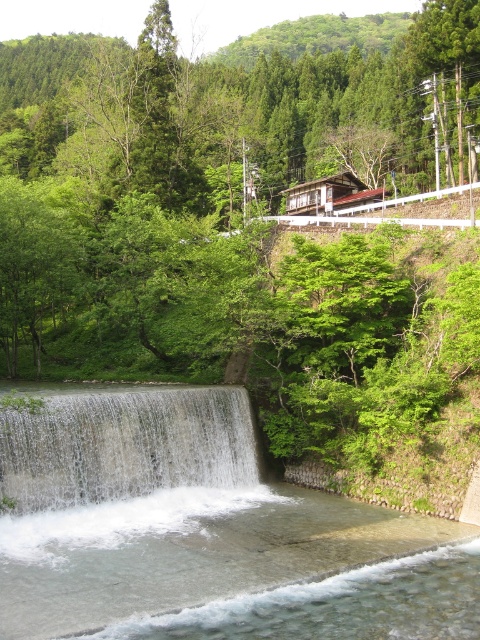
Is clear water at center positioned behind white frothy water at center?

No.

Is point (71, 403) less distant than point (11, 422)?

That is False.

Is point (383, 589) more distant than point (156, 458)?

No, it is in front of (156, 458).

Image resolution: width=480 pixels, height=640 pixels. I want to click on clear water at center, so click(204, 532).